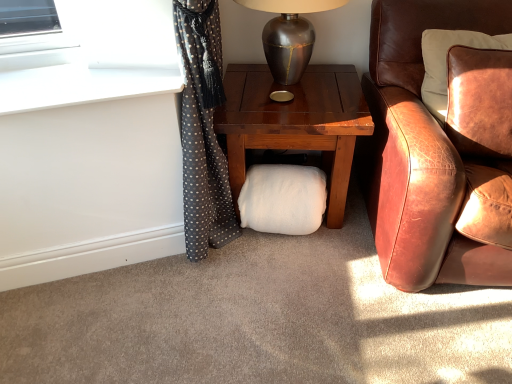
Identify the location of vacant region under metallic silver table lamp at upper center (from a real-world perspective). The width and height of the screenshot is (512, 384). (298, 84).